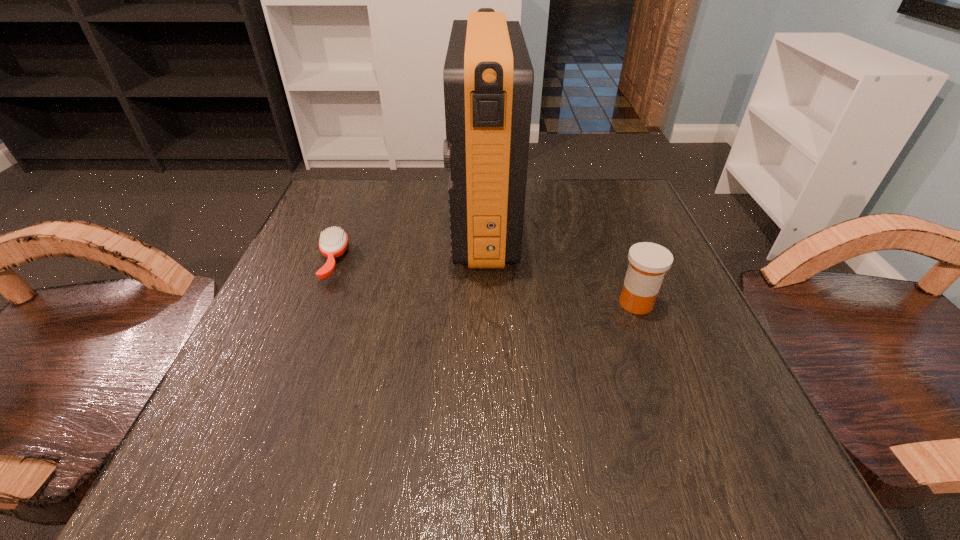
Locate an element on the screen. Image resolution: width=960 pixels, height=540 pixels. free space at the far right corner is located at coordinates (588, 179).

The width and height of the screenshot is (960, 540). What are the coordinates of `vacant space at the near right corner of the desktop` in the screenshot? It's located at coord(659,425).

The image size is (960, 540). I want to click on empty space between the shortest object and the tallest object, so click(408, 242).

Locate an element on the screen. The width and height of the screenshot is (960, 540). vacant space in between the rightmost object and the shortest object is located at coordinates (484, 282).

The image size is (960, 540). Find the location of `vacant area that lies between the hairbrush and the radio receiver`. vacant area that lies between the hairbrush and the radio receiver is located at coordinates (408, 242).

Identify the location of free space between the radio receiver and the shortest object. This screenshot has height=540, width=960. (408, 242).

Locate an element on the screen. free space between the radio receiver and the hairbrush is located at coordinates (408, 242).

Where is `vacant space in between the medicine and the tallest object`? The width and height of the screenshot is (960, 540). vacant space in between the medicine and the tallest object is located at coordinates (560, 263).

Locate an element on the screen. The height and width of the screenshot is (540, 960). empty space that is in between the second object from left to right and the second tallest object is located at coordinates (560, 263).

Where is `free space between the rightmost object and the leftmost object`? free space between the rightmost object and the leftmost object is located at coordinates (484, 282).